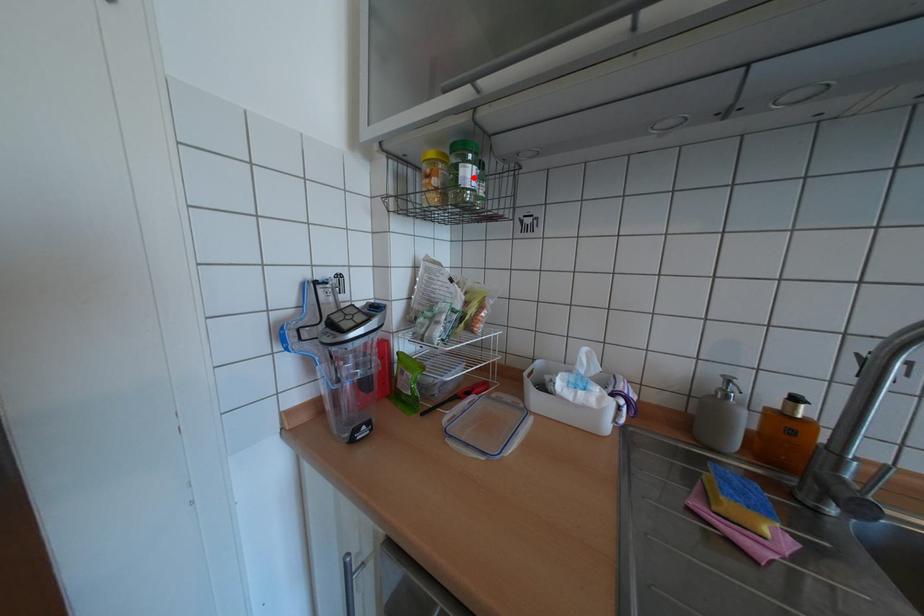
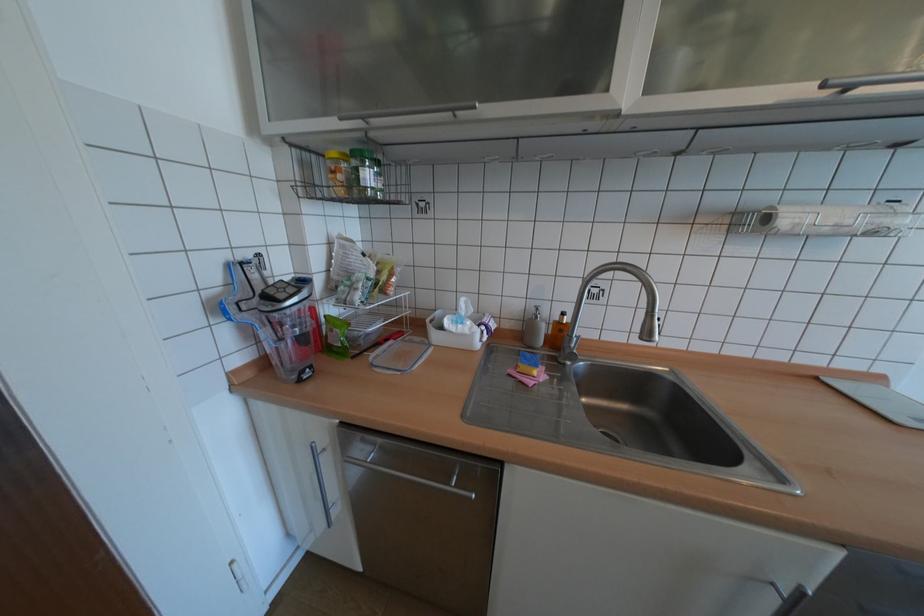
Locate, in the second image, the point that corresponds to the highlighted location in the first image.

(373, 179)